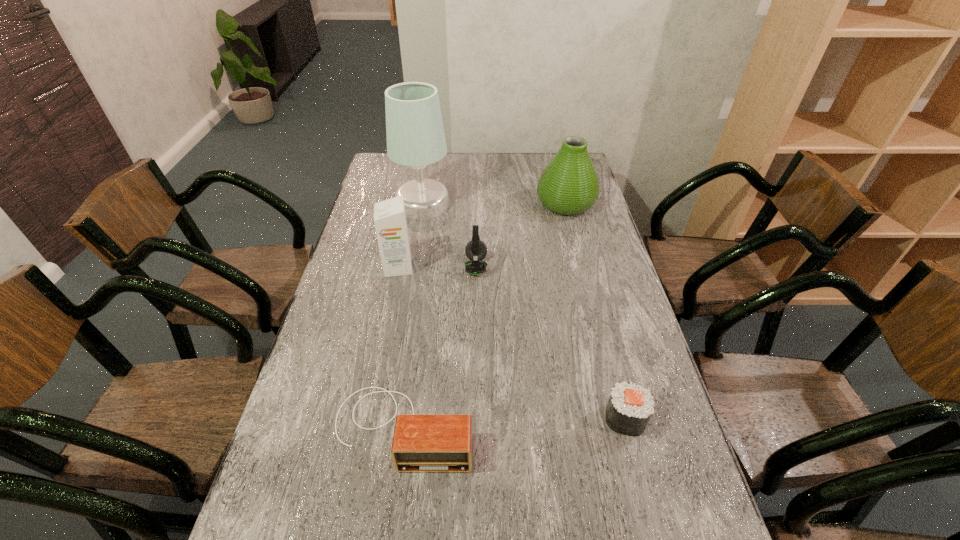
Select which object is the fifth closest to the lampshade. Please provide its 2D coordinates. Your answer should be formatted as a tuple, i.e. [(x, y)], where the tuple contains the x and y coordinates of a point satisfying the conditions above.

[(630, 406)]

I want to click on vacant space that satisfies the following two spatial constraints: 1. on the base of the sushi; 2. on the right side of the lampshade, so click(387, 418).

Where is `free spot that satisfies the following two spatial constraints: 1. on the base of the tallest object; 2. on the back side of the sushi`? The width and height of the screenshot is (960, 540). free spot that satisfies the following two spatial constraints: 1. on the base of the tallest object; 2. on the back side of the sushi is located at coordinates (387, 418).